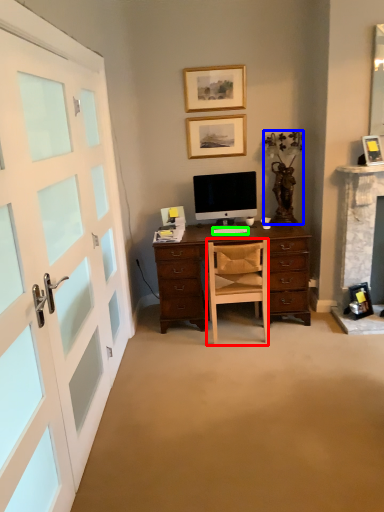
Question: Considering the real-world distances, which object is farthest from chair (highlighted by a red box)? houseplant (highlighted by a blue box) or computer keyboard (highlighted by a green box)?

Choices:
 (A) houseplant
 (B) computer keyboard

Answer: (A)